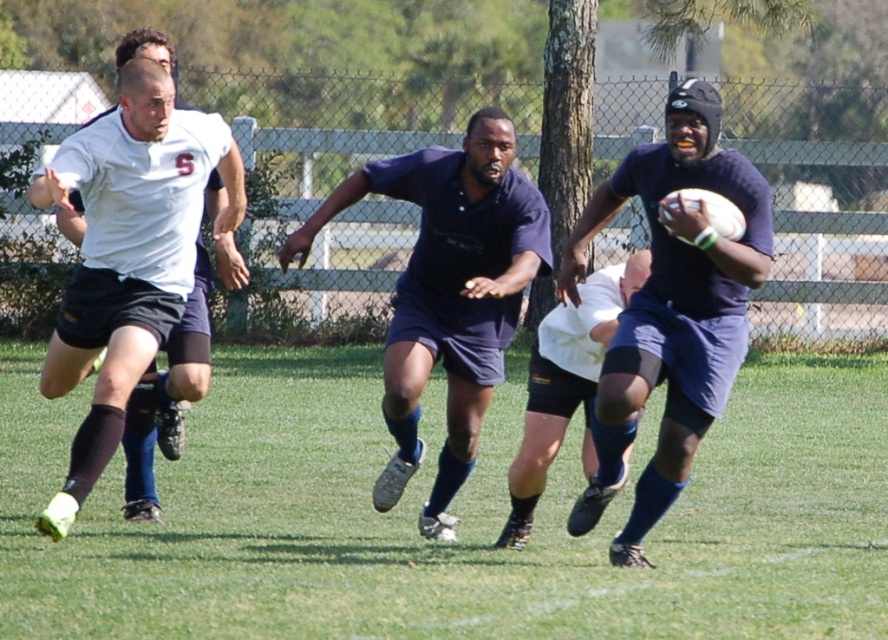
You are a referee observing the rugby match. You notice the dark blue jersey at center and the white matte rugby ball at center. Which object is higher in position?

The dark blue jersey at center is much taller than the white matte rugby ball at center, so the dark blue jersey at center is higher in position.

You are a rugby player positioned at point (x=422, y=496) and need to pass the ball to your teammate at point (x=546, y=444). Considering their positions, will your pass travel towards or away from the opposing team in the background?

The pass from point (x=422, y=496) to point (x=546, y=444) will travel towards the opposing team in the background because point (x=422, y=496) is closer to the viewer than point (x=546, y=444), meaning the ball is moving away from the viewer and towards the opposing team located behind.

You are a referee observing the rugby match. You need to determine the position of the dark blue jersey at center relative to the field. Where is it located?

The dark blue jersey at center is located at point coordinates (671, 308) on the field.